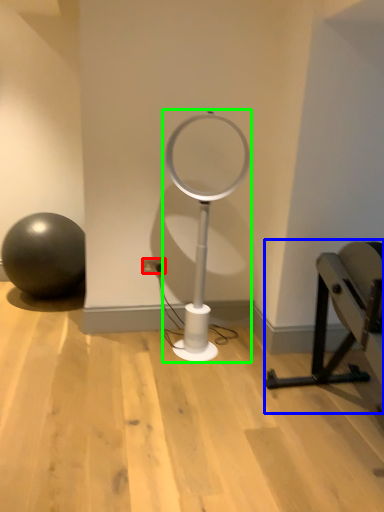
Question: Estimate the real-world distances between objects in this image. Which object is farther from electric outlet (highlighted by a red box), furniture (highlighted by a blue box) or table lamp (highlighted by a green box)?

Choices:
 (A) furniture
 (B) table lamp

Answer: (A)